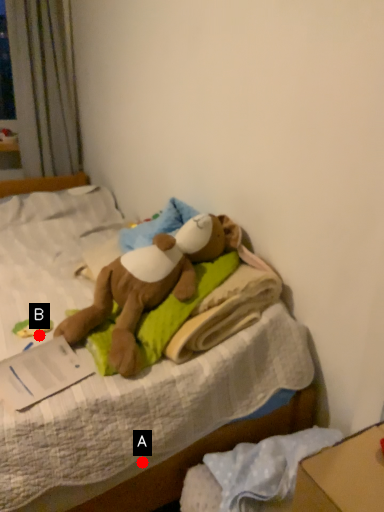
Question: Two points are circled on the image, labeled by A and B beside each circle. Which of the following is the closest to the observer?

Choices:
 (A) A is closer
 (B) B is closer

Answer: (A)